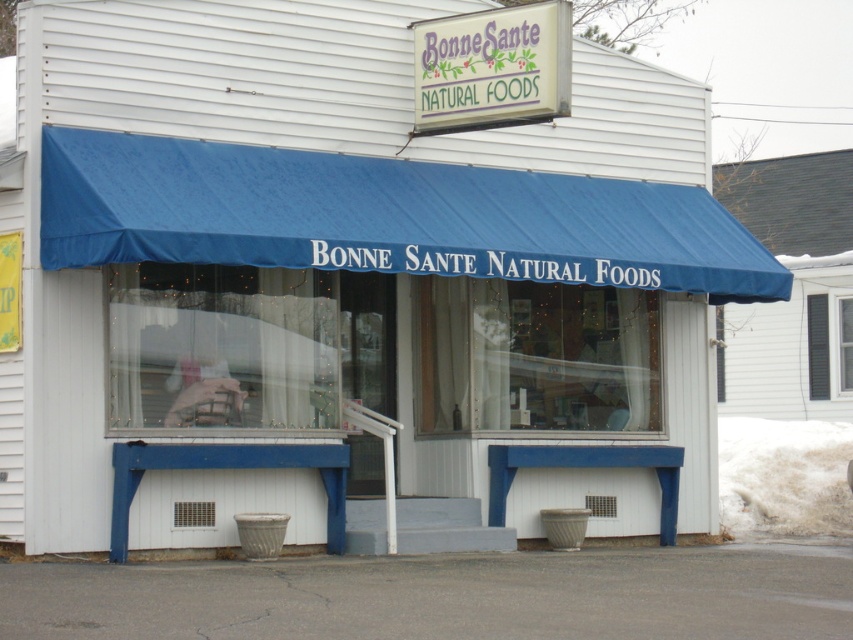
Question: Is transparent plastic window at center in front of matte plastic sign at upper center?

Choices:
 (A) no
 (B) yes

Answer: (B)

Question: Which object is positioned closest to the black wood window at upper right?

Choices:
 (A) matte plastic sign at upper center
 (B) blue fabric canopy at center
 (C) transparent plastic window at center

Answer: (A)

Question: Which object is farther from the camera taking this photo?

Choices:
 (A) matte plastic sign at upper center
 (B) black wood window at upper right

Answer: (B)

Question: Is matte plastic sign at upper center closer to camera compared to black wood window at upper right?

Choices:
 (A) yes
 (B) no

Answer: (A)

Question: Is blue fabric canopy at center bigger than black wood window at upper right?

Choices:
 (A) no
 (B) yes

Answer: (A)

Question: Which object is farther from the camera taking this photo?

Choices:
 (A) matte plastic sign at upper center
 (B) transparent plastic window at center
 (C) blue fabric canopy at center
 (D) black wood window at upper right

Answer: (D)